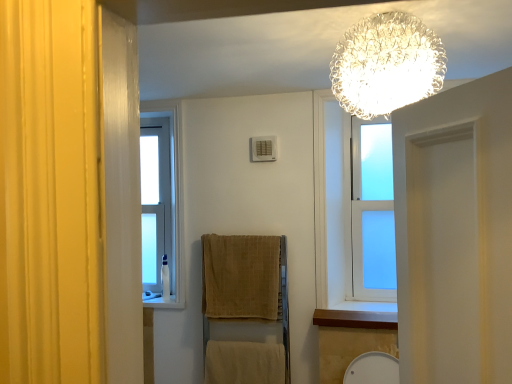
Question: Is beige cotton towel at lower center, placed as the second bath towel when sorted from top to bottom, positioned with its back to wooden at lower right?

Choices:
 (A) yes
 (B) no

Answer: (B)

Question: Is beige cotton towel at lower center, placed as the first bath towel when sorted from bottom to top, further to camera compared to wooden at lower right?

Choices:
 (A) no
 (B) yes

Answer: (B)

Question: Would you say beige cotton towel at lower center, placed as the second bath towel when sorted from top to bottom, contains wooden at lower right?

Choices:
 (A) yes
 (B) no

Answer: (B)

Question: Is the surface of beige cotton towel at lower center, placed as the second bath towel when sorted from top to bottom, in direct contact with wooden at lower right?

Choices:
 (A) yes
 (B) no

Answer: (B)

Question: Is beige cotton towel at lower center, placed as the first bath towel when sorted from bottom to top, facing towards wooden at lower right?

Choices:
 (A) no
 (B) yes

Answer: (A)

Question: Visually, is wooden at lower right positioned to the left or to the right of crystalline glass chandelier at upper center?

Choices:
 (A) left
 (B) right

Answer: (B)

Question: In terms of width, does wooden at lower right look wider or thinner when compared to crystalline glass chandelier at upper center?

Choices:
 (A) thin
 (B) wide

Answer: (A)

Question: From a real-world perspective, is wooden at lower right positioned above or below crystalline glass chandelier at upper center?

Choices:
 (A) below
 (B) above

Answer: (A)

Question: Considering the positions of wooden at lower right and crystalline glass chandelier at upper center in the image, is wooden at lower right bigger or smaller than crystalline glass chandelier at upper center?

Choices:
 (A) small
 (B) big

Answer: (A)

Question: Relative to wooden at lower right, is beige cotton towel at lower center, placed as the second bath towel when sorted from top to bottom, in front or behind?

Choices:
 (A) behind
 (B) front

Answer: (A)

Question: From the image's perspective, relative to wooden at lower right, is beige cotton towel at lower center, placed as the second bath towel when sorted from top to bottom, above or below?

Choices:
 (A) below
 (B) above

Answer: (A)

Question: From a real-world perspective, relative to wooden at lower right, is beige cotton towel at lower center, placed as the second bath towel when sorted from top to bottom, vertically above or below?

Choices:
 (A) below
 (B) above

Answer: (A)

Question: Looking at the image, does beige cotton towel at lower center, placed as the second bath towel when sorted from top to bottom, seem bigger or smaller compared to wooden at lower right?

Choices:
 (A) big
 (B) small

Answer: (A)

Question: Considering the positions of wooden at lower right and beige cotton towel at lower center, placed as the second bath towel when sorted from top to bottom, in the image, is wooden at lower right wider or thinner than beige cotton towel at lower center, placed as the second bath towel when sorted from top to bottom,?

Choices:
 (A) thin
 (B) wide

Answer: (B)

Question: From a real-world perspective, relative to beige cotton towel at lower center, placed as the second bath towel when sorted from top to bottom, is wooden at lower right vertically above or below?

Choices:
 (A) above
 (B) below

Answer: (A)